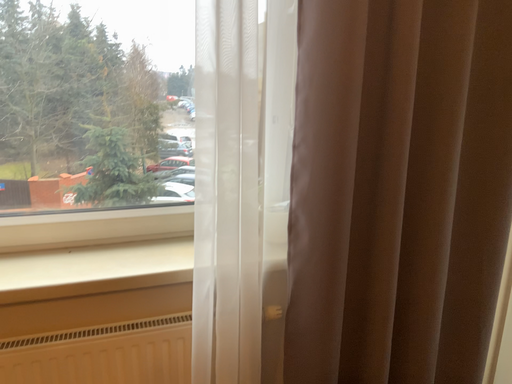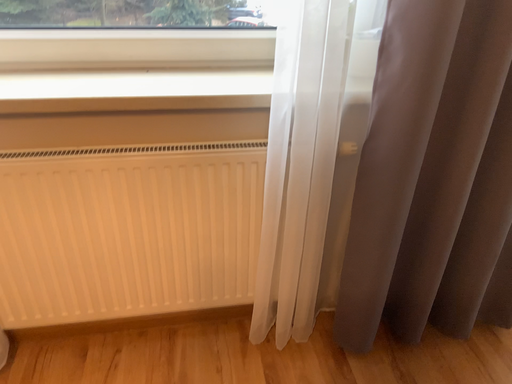
Question: Which way did the camera rotate in the video?

Choices:
 (A) rotated right
 (B) rotated left

Answer: (B)